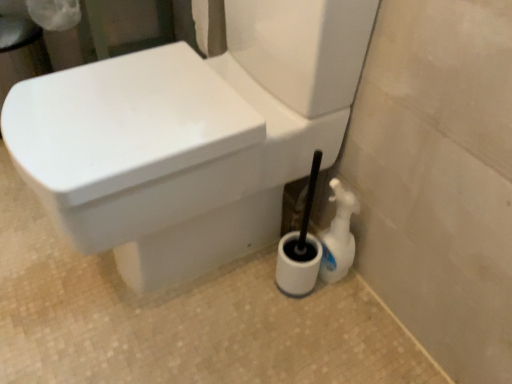
Question: Is white plastic spray bottle at lower right positioned beyond the bounds of white glossy toilet at center?

Choices:
 (A) no
 (B) yes

Answer: (B)

Question: Would you consider white plastic spray bottle at lower right to be distant from white glossy toilet at center?

Choices:
 (A) yes
 (B) no

Answer: (B)

Question: Considering the relative positions of white plastic spray bottle at lower right and white glossy toilet at center in the image provided, is white plastic spray bottle at lower right to the right of white glossy toilet at center from the viewer's perspective?

Choices:
 (A) yes
 (B) no

Answer: (A)

Question: Is white plastic spray bottle at lower right bigger than white glossy toilet at center?

Choices:
 (A) yes
 (B) no

Answer: (B)

Question: Is white plastic spray bottle at lower right oriented towards white glossy toilet at center?

Choices:
 (A) no
 (B) yes

Answer: (A)

Question: From a real-world perspective, is white plastic spray bottle at lower right beneath white glossy toilet at center?

Choices:
 (A) yes
 (B) no

Answer: (A)

Question: Is white glossy toilet at center further to the viewer compared to white plastic spray bottle at lower right?

Choices:
 (A) no
 (B) yes

Answer: (A)

Question: Considering the relative sizes of white glossy toilet at center and white plastic spray bottle at lower right in the image provided, is white glossy toilet at center wider than white plastic spray bottle at lower right?

Choices:
 (A) yes
 (B) no

Answer: (A)

Question: From a real-world perspective, does white glossy toilet at center sit lower than white plastic spray bottle at lower right?

Choices:
 (A) yes
 (B) no

Answer: (B)

Question: Is white glossy toilet at center taller than white plastic spray bottle at lower right?

Choices:
 (A) no
 (B) yes

Answer: (B)

Question: Is white glossy toilet at center not within white plastic spray bottle at lower right?

Choices:
 (A) yes
 (B) no

Answer: (A)

Question: From the image's perspective, is white glossy toilet at center under white plastic spray bottle at lower right?

Choices:
 (A) no
 (B) yes

Answer: (A)

Question: In terms of size, does white glossy toilet at center appear bigger or smaller than white plastic spray bottle at lower right?

Choices:
 (A) small
 (B) big

Answer: (B)